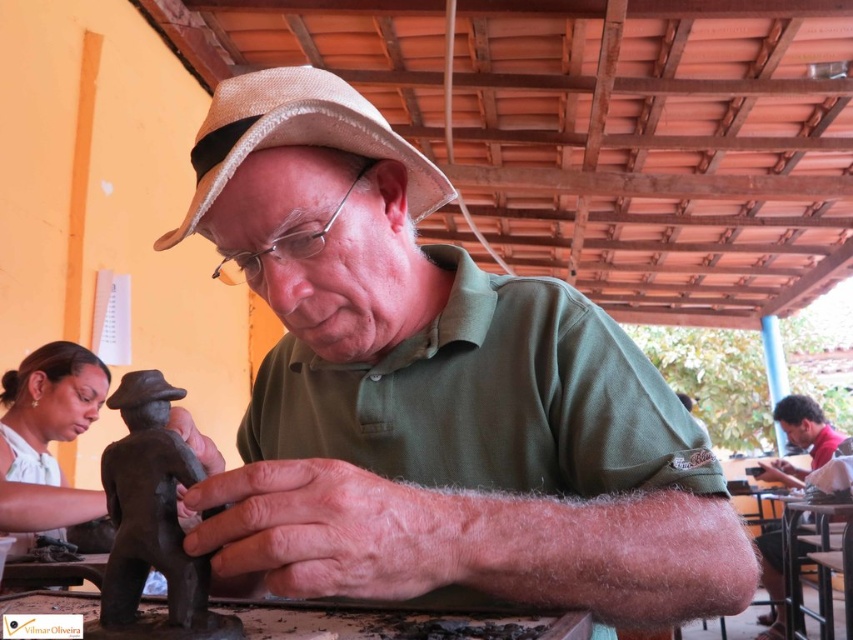
You are a photographer standing at a distance of 20 inches from the elderly man. You want to take a photo of the point at coordinates point (305, 592). Will you need to adjust your position to ensure the point is in focus?

The distance of point (305, 592) from camera is 19.71 inches, so you are currently 20 inches away. Since the point is slightly closer than your current position, you should move about 0.29 inches closer to ensure the point is in focus.